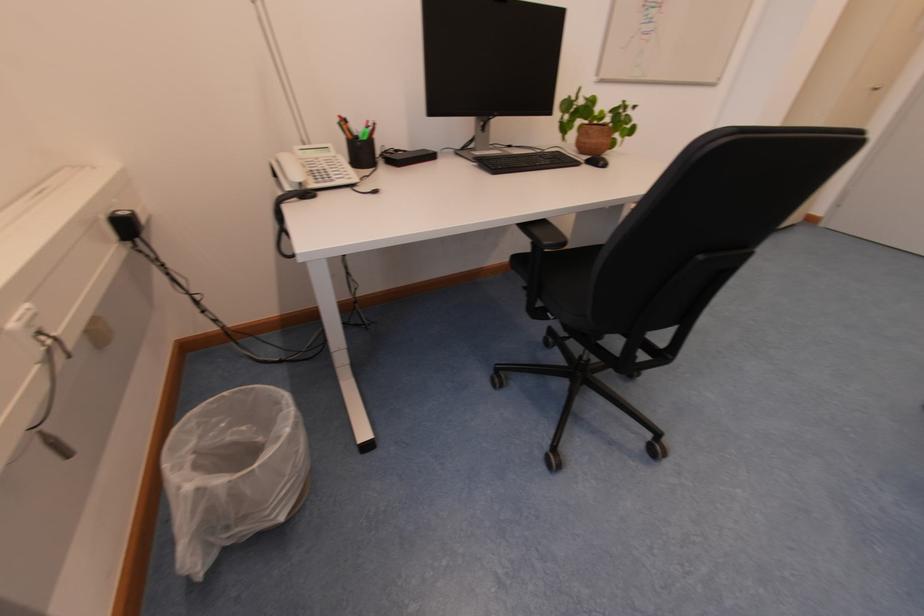
This screenshot has height=616, width=924. Describe the element at coordinates (359, 143) in the screenshot. I see `a green pen` at that location.